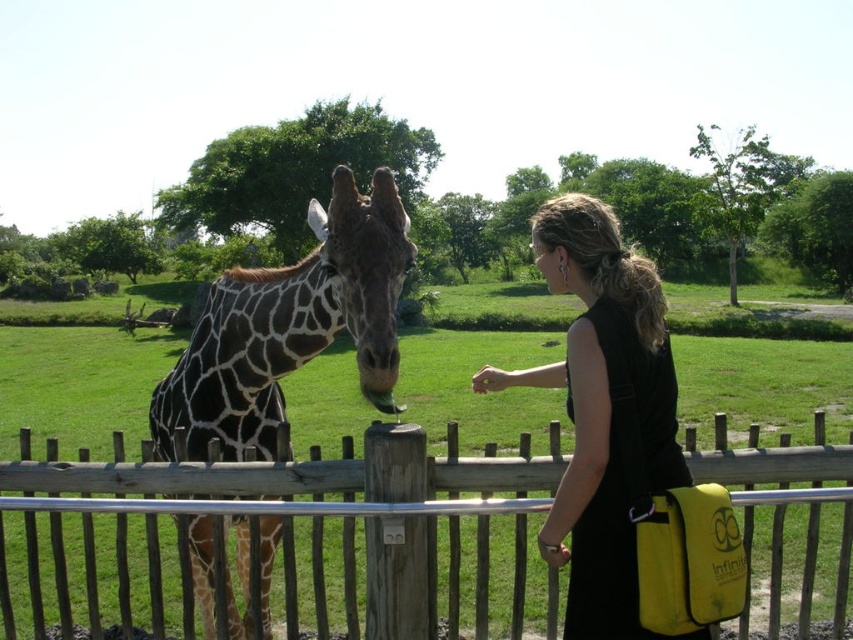
Question: Based on their relative distances, which object is farther from the wooden fence at center?

Choices:
 (A) spotted fur giraffe at center
 (B) black fabric dress at center

Answer: (A)

Question: Is wooden fence at center bigger than black fabric dress at center?

Choices:
 (A) yes
 (B) no

Answer: (B)

Question: Which object is farther from the camera taking this photo?

Choices:
 (A) black fabric dress at center
 (B) spotted fur giraffe at center
 (C) wooden fence at center

Answer: (C)

Question: Can you confirm if spotted fur giraffe at center is bigger than black fabric dress at center?

Choices:
 (A) yes
 (B) no

Answer: (B)

Question: Which object is the farthest from the spotted fur giraffe at center?

Choices:
 (A) black fabric dress at center
 (B) wooden fence at center

Answer: (B)

Question: Is the position of wooden fence at center less distant than that of black fabric dress at center?

Choices:
 (A) yes
 (B) no

Answer: (B)